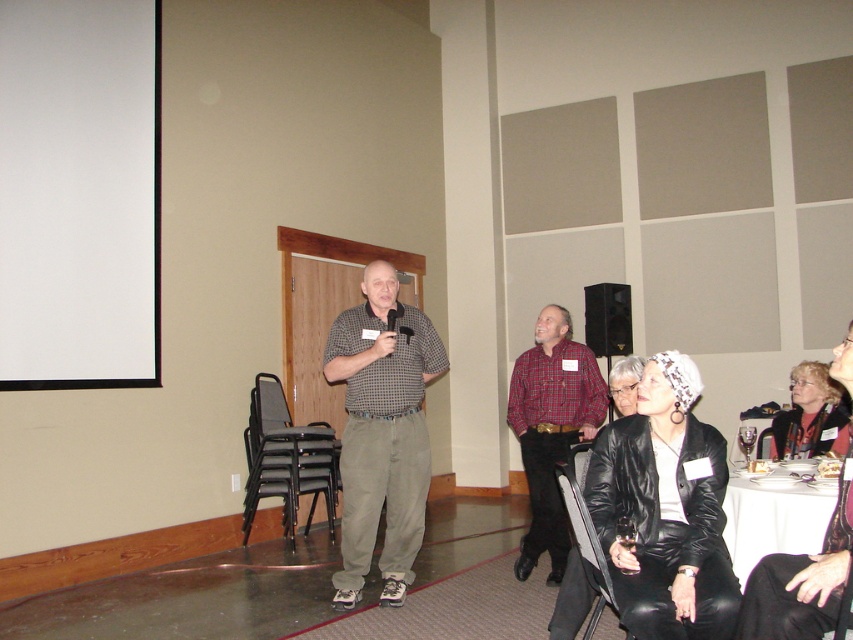
Consider the image. You are an event organizer who needs to adjust the seating arrangement. You notice the black leather jacket at lower right and the matte black speaker at center. Which object is closer to the front of the stage?

The black leather jacket at lower right is closer to the front of the stage because it is in front of the matte black speaker at center.

You are organizing a small event and need to place a decorative pillow on the stage. The black leather jacket at lower right and the plaid shirt at center are already on the stage. Which object should you place the pillow next to to ensure it doesn

The black leather jacket at lower right is smaller than the plaid shirt at center, so placing the pillow next to the plaid shirt at center would provide more space for the pillow to fit comfortably.